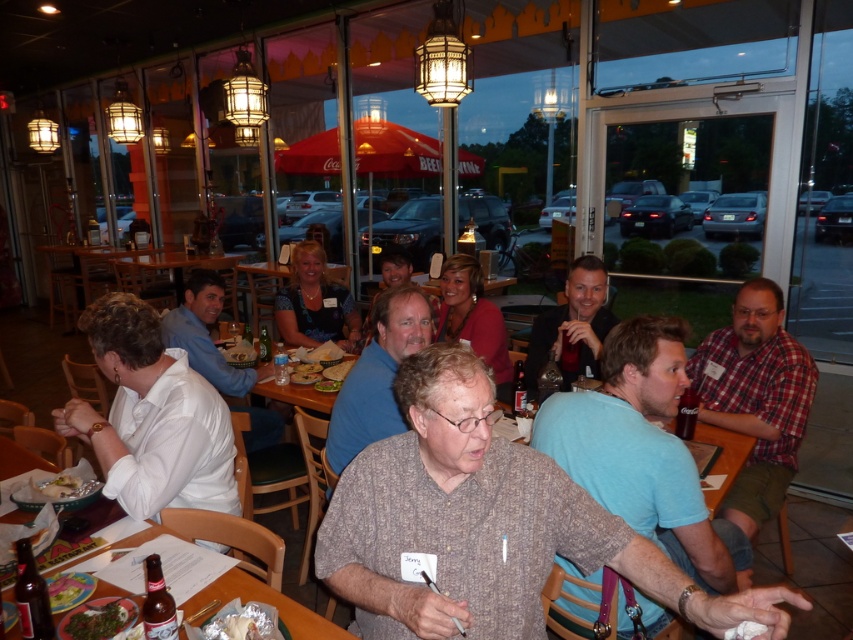
You are a customer at the restaurant and want to order a green leafy vegetable. The server mentions that the vegetable is located at point (96,621) on the menu. Can you confirm if this is the correct location for the green leafy vegetable?

The green leafy vegetable at lower left is represented by point (96,621), so yes, this is the correct location for the green leafy vegetable.

You are a photographer trying to capture a group photo of the two people wearing the light blue shirt at center and matte black shirt at center. Since you want to ensure both subjects are clearly visible, which shirt should you focus on first to account for their sizes?

A: The light blue shirt at center is bigger than the matte black shirt at center, so you should focus on the light blue shirt at center first as it occupies more space and will be easier to capture clearly.

You are a photographer standing in the restaurant and want to take a photo that includes both the point at (374,404) and the point at (260,595). Which point should you focus on first to ensure both are in sharp focus?

You should focus on the point at (260,595) first because it is closer to you than the point at (374,404), which is further away. By focusing on the closer point, the depth of field may help keep both points in focus.